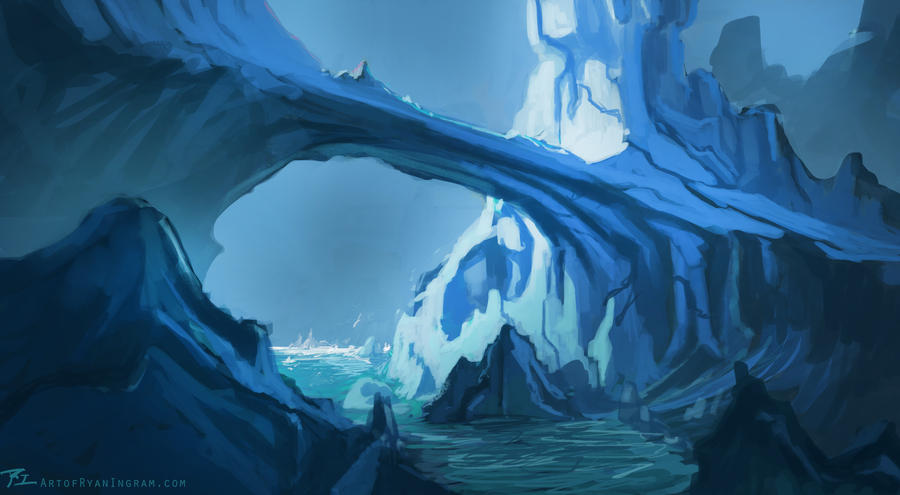
Locate an element on the screen. The height and width of the screenshot is (495, 900). markers is located at coordinates (730, 249).